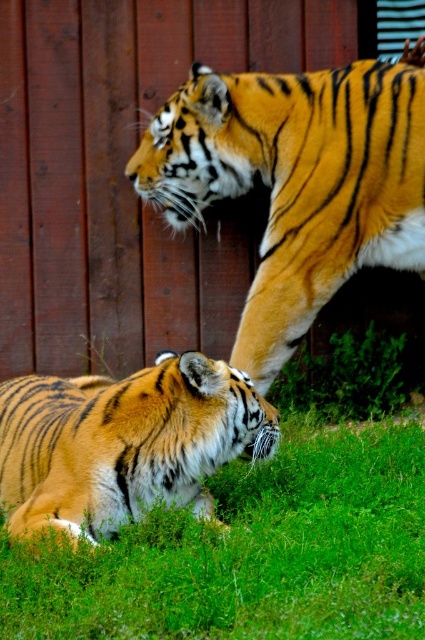
Identify the location of orange-yellow fur tiger at upper center. The image size is (425, 640). (295, 182).

Can you confirm if orange-yellow fur tiger at upper center is smaller than orange fur tiger at lower left?

Actually, orange-yellow fur tiger at upper center might be larger than orange fur tiger at lower left.

At what (x,y) coordinates should I click in order to perform the action: click on orange-yellow fur tiger at upper center. Please return your answer as a coordinate pair (x, y). The image size is (425, 640). Looking at the image, I should click on (295, 182).

Who is shorter, green grass at lower center or orange-yellow fur tiger at upper center?

Standing shorter between the two is green grass at lower center.

Between point (405, 483) and point (328, 80), which one is positioned in front?

Point (405, 483) is more forward.

I want to click on green grass at lower center, so 249,554.

This screenshot has width=425, height=640. Find the location of `green grass at lower center`. green grass at lower center is located at coordinates tap(249, 554).

Is green grass at lower center bigger than orange fur tiger at lower left?

Yes, green grass at lower center is bigger than orange fur tiger at lower left.

Which is in front, point (184, 604) or point (218, 433)?

Point (184, 604) is in front.

Identify the location of green grass at lower center. (249, 554).